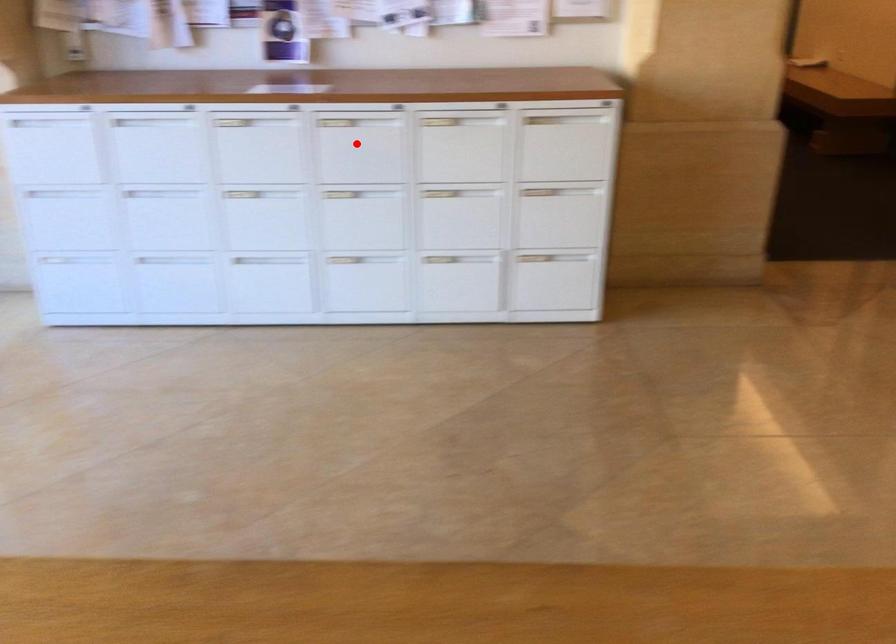
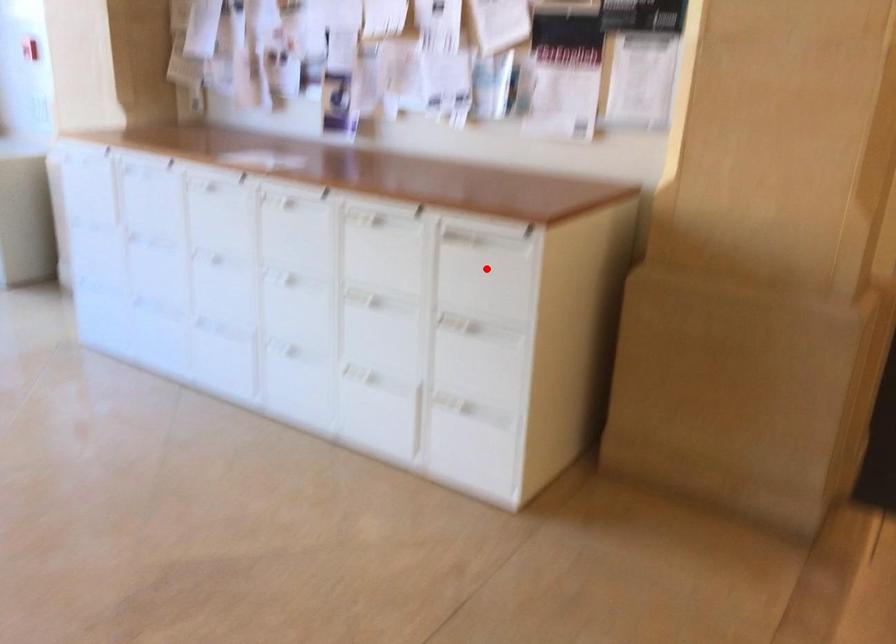
I am providing you with two images of the same scene from different viewpoints. A red point is marked on the first image and another point is marked on the second image. Does the point marked in image1 correspond to the same location as the one in image2?

No